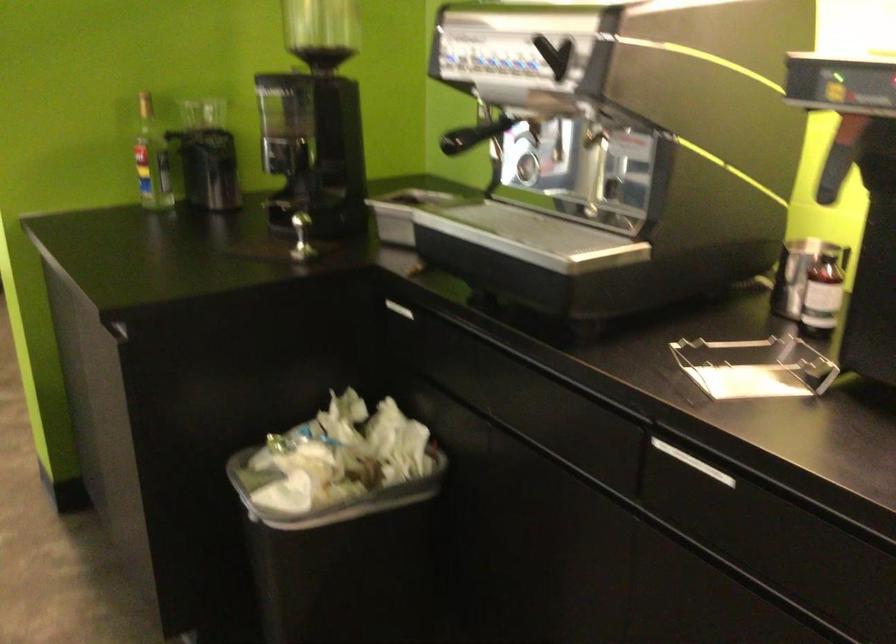
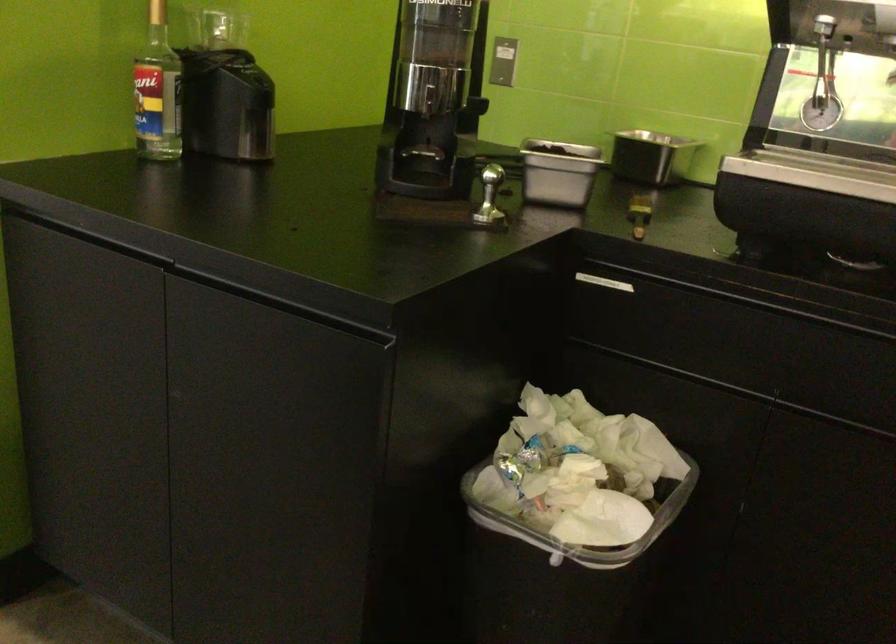
Locate, in the second image, the point that corresponds to [213,111] in the first image.

(216, 29)